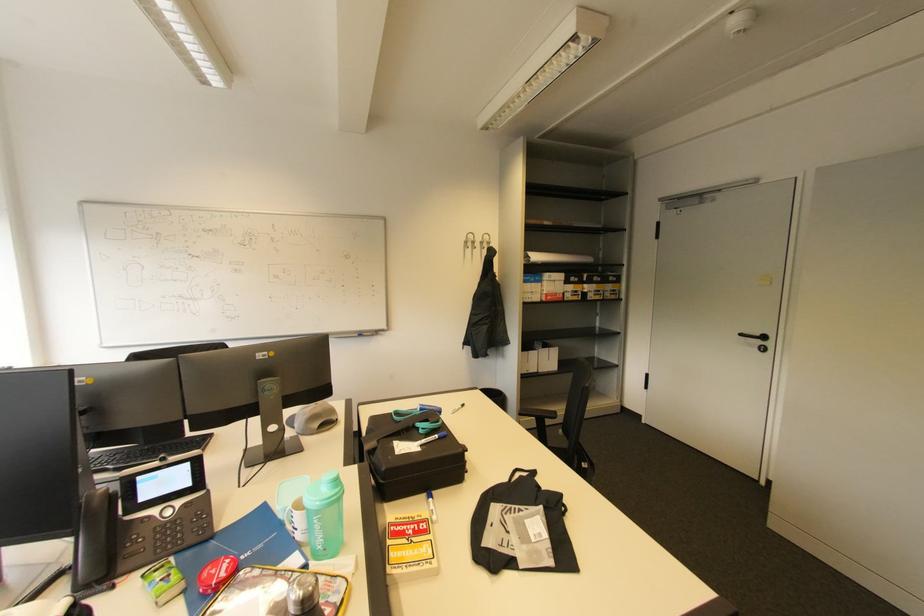
This screenshot has height=616, width=924. In order to click on telephone handset in this screenshot , I will do `click(95, 540)`.